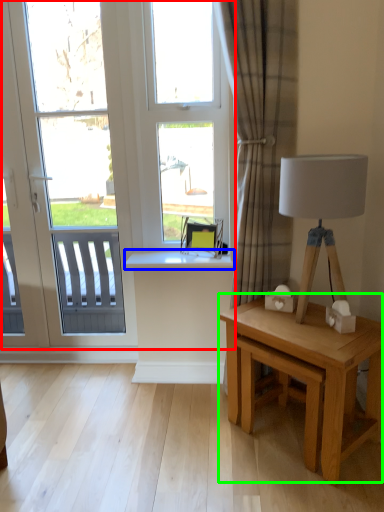
Question: Based on their relative distances, which object is farther from window (highlighted by a red box)? Choose from window sill (highlighted by a blue box) and table (highlighted by a green box).

Choices:
 (A) window sill
 (B) table

Answer: (B)